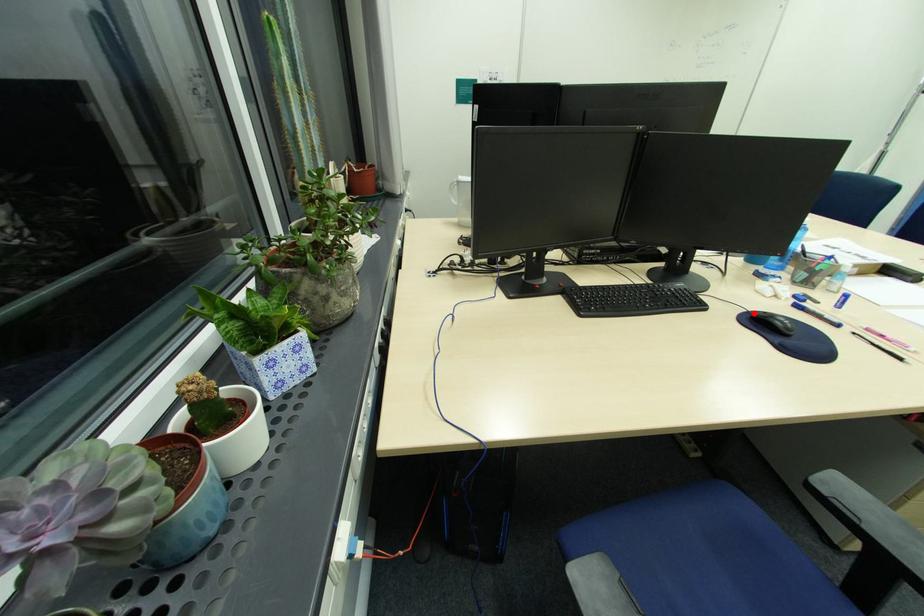
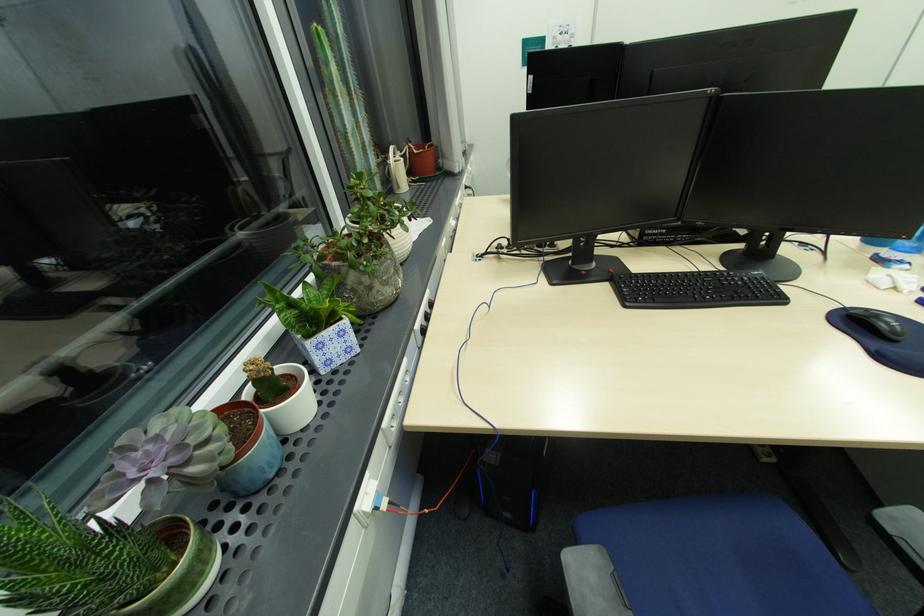
Where in the second image is the point corresponding to the highlighted location from the first image?

(849, 310)